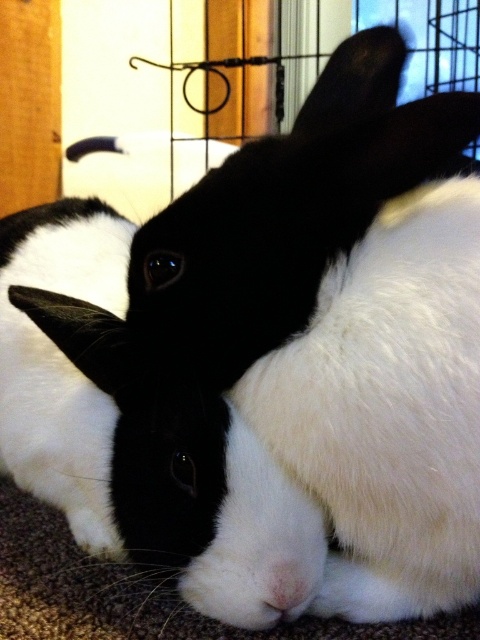
Question: In this image, where is wooden screen door at upper left located relative to white soft fur nose at center?

Choices:
 (A) right
 (B) left

Answer: (B)

Question: Which point is farther to the camera?

Choices:
 (A) wooden screen door at upper left
 (B) white soft fur nose at center

Answer: (A)

Question: Is wooden screen door at upper left to the right of white soft fur nose at center from the viewer's perspective?

Choices:
 (A) yes
 (B) no

Answer: (B)

Question: Which object is closer to the camera taking this photo?

Choices:
 (A) wooden screen door at upper left
 (B) white soft fur nose at center

Answer: (B)

Question: Is wooden screen door at upper left wider than white soft fur nose at center?

Choices:
 (A) yes
 (B) no

Answer: (A)